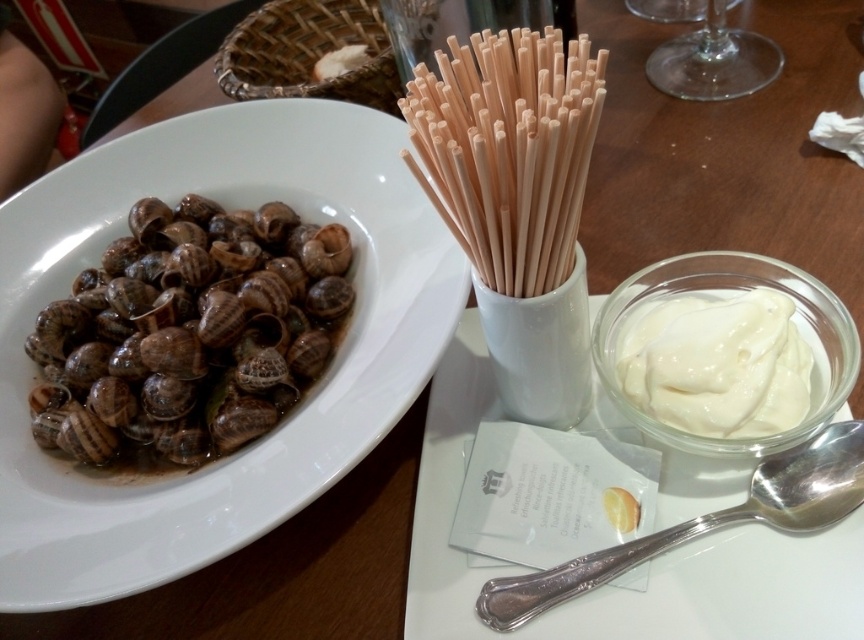
Is point (547, 51) farther from viewer compared to point (748, 65)?

No, it is not.

Is wooden sticks at center thinner than transparent glass at upper right?

Indeed, wooden sticks at center has a lesser width compared to transparent glass at upper right.

Does point (545, 145) lie behind point (748, 35)?

That is False.

Where is `wooden sticks at center`? The image size is (864, 640). wooden sticks at center is located at coordinates (507, 148).

Can you confirm if brown striped snails at left is positioned to the right of white creamy cheese at upper center?

No, brown striped snails at left is not to the right of white creamy cheese at upper center.

Who is taller, brown striped snails at left or white creamy cheese at upper center?

With more height is brown striped snails at left.

Is point (296, 321) farther from camera compared to point (345, 61)?

No, it is in front of (345, 61).

You are a GUI agent. You are given a task and a screenshot of the screen. Output one action in this format:
    pyautogui.click(x=<x>, y=<y>)
    Task: Click on the brown striped snails at left
    This screenshot has width=864, height=640.
    Given the screenshot: What is the action you would take?
    pyautogui.click(x=188, y=333)

Does white creamy sauce at right appear under transparent glass at upper right?

Yes, white creamy sauce at right is below transparent glass at upper right.

This screenshot has height=640, width=864. Find the location of `white creamy sauce at right`. white creamy sauce at right is located at coordinates (718, 365).

At what (x,y) coordinates should I click in order to perform the action: click on white creamy sauce at right. Please return your answer as a coordinate pair (x, y). Image resolution: width=864 pixels, height=640 pixels. Looking at the image, I should click on (718, 365).